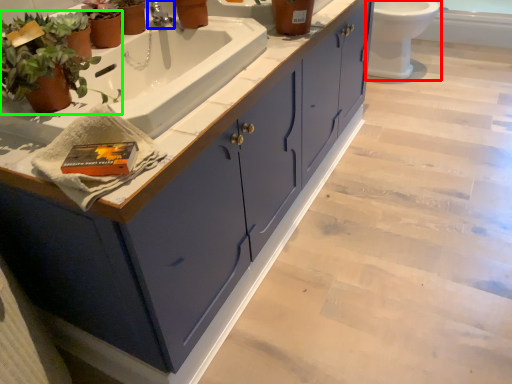
Question: Which is farther away from toilet (highlighted by a red box)? tap (highlighted by a blue box) or houseplant (highlighted by a green box)?

Choices:
 (A) tap
 (B) houseplant

Answer: (B)